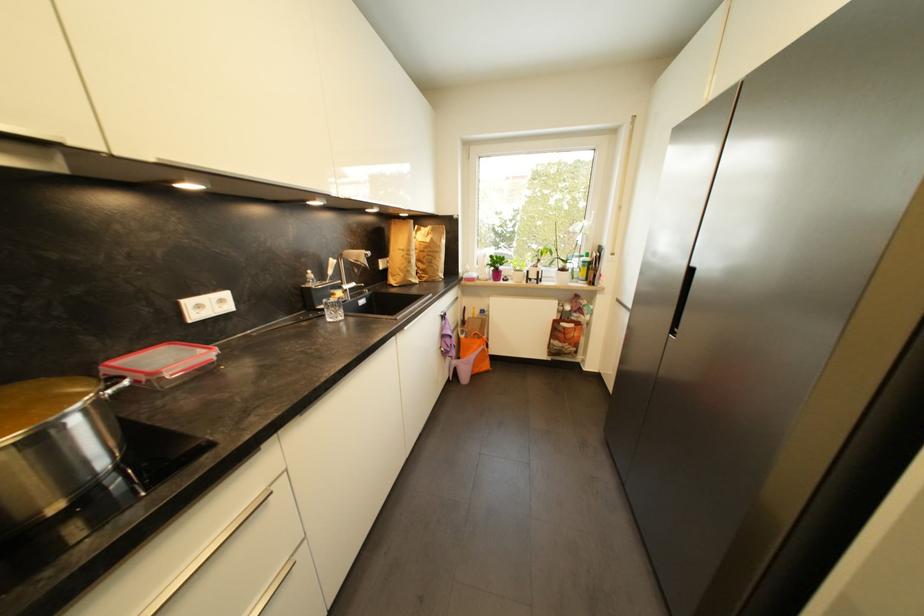
This screenshot has width=924, height=616. What do you see at coordinates (350, 265) in the screenshot? I see `the faucet handle` at bounding box center [350, 265].